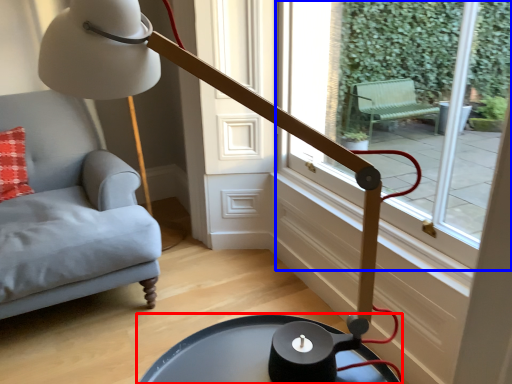
Question: Which object appears closest to the camera in this image, table (highlighted by a red box) or window (highlighted by a blue box)?

Choices:
 (A) table
 (B) window

Answer: (A)